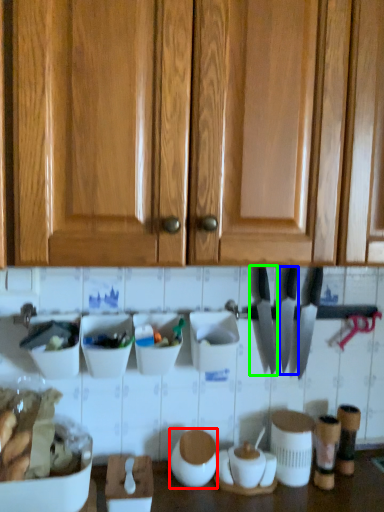
Question: Which object is positioned farthest from appliance (highlighted by a red box)? Select from knife (highlighted by a blue box) and knife (highlighted by a green box).

Choices:
 (A) knife
 (B) knife

Answer: (A)